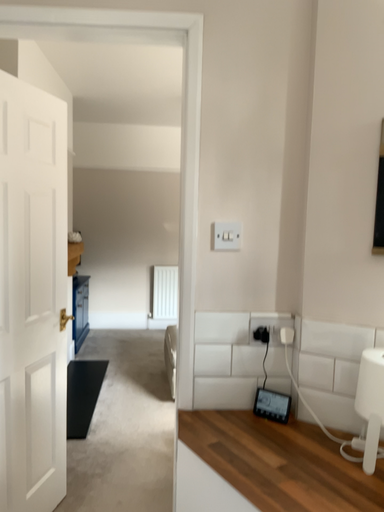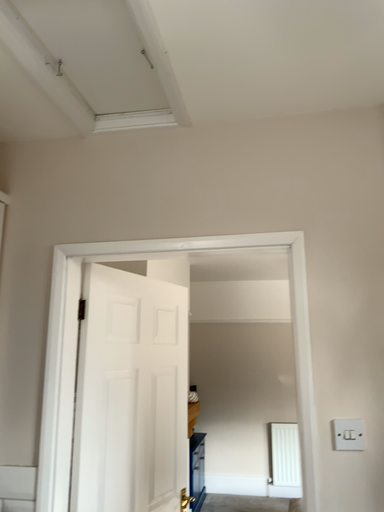
Question: Which way did the camera rotate in the video?

Choices:
 (A) rotated right
 (B) rotated left

Answer: (B)